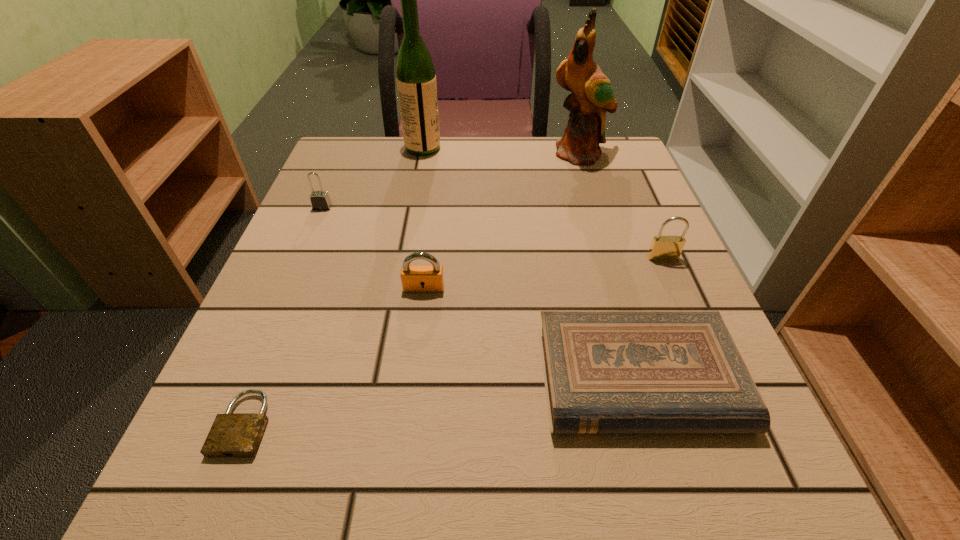
Find the location of a particular element. The width and height of the screenshot is (960, 540). object identified as the fifth closest to the sixth tallest object is located at coordinates coord(320,200).

This screenshot has width=960, height=540. Find the location of `the closest object to the second farthest padlock`. the closest object to the second farthest padlock is located at coordinates (604, 371).

Locate which padlock is the second closest to the fifth nearest object. Please provide its 2D coordinates. Your answer should be formatted as a tuple, i.e. [(x, y)], where the tuple contains the x and y coordinates of a point satisfying the conditions above.

[(232, 434)]

Image resolution: width=960 pixels, height=540 pixels. In order to click on padlock identified as the third closest to the shortest object in this screenshot , I will do `click(663, 248)`.